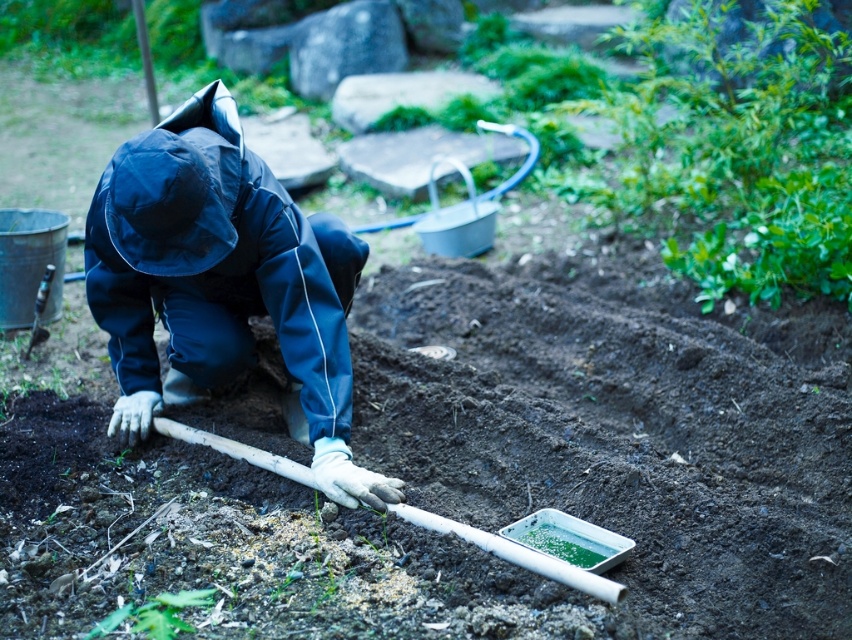
Which is more to the left, dark brown soil at center or navy blue waterproof suit at center?

Positioned to the left is navy blue waterproof suit at center.

Is dark brown soil at center shorter than navy blue waterproof suit at center?

Indeed, dark brown soil at center has a lesser height compared to navy blue waterproof suit at center.

Locate an element on the screen. This screenshot has height=640, width=852. dark brown soil at center is located at coordinates (469, 468).